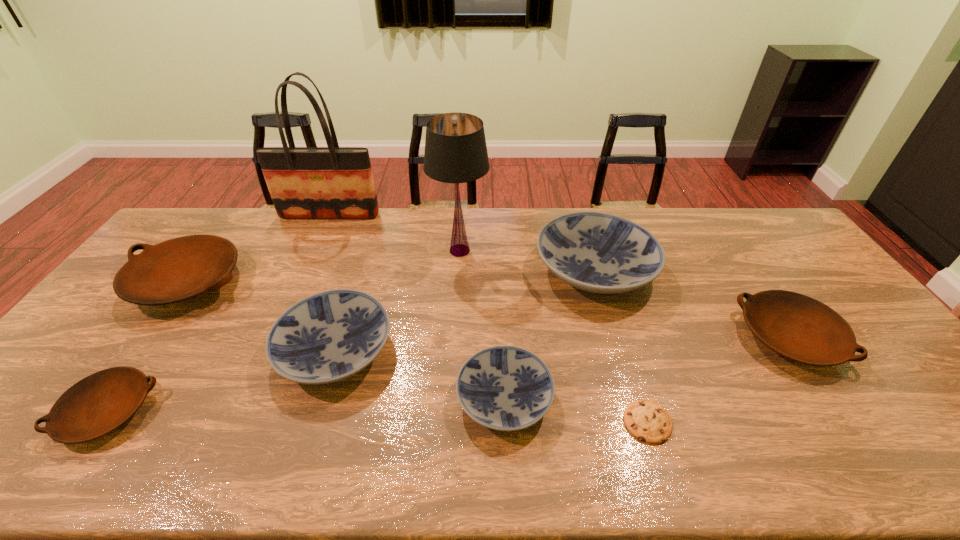
Locate an element on the screen. This screenshot has width=960, height=540. vacant space that satisfies the following two spatial constraints: 1. on the front-facing side of the lampshade; 2. on the back side of the shortest object is located at coordinates (450, 422).

I want to click on free point that satisfies the following two spatial constraints: 1. on the front side of the eighth tallest object; 2. on the left side of the biggest brown plate, so click(x=94, y=411).

Image resolution: width=960 pixels, height=540 pixels. Find the location of `vacant space that satisfies the following two spatial constraints: 1. on the front-facing side of the second smallest brown plate; 2. on the right side of the farthest object`. vacant space that satisfies the following two spatial constraints: 1. on the front-facing side of the second smallest brown plate; 2. on the right side of the farthest object is located at coordinates (275, 338).

Where is `free space that satisfies the following two spatial constraints: 1. on the front-facing side of the farthest object; 2. on the right side of the second biggest brown plate`? The width and height of the screenshot is (960, 540). free space that satisfies the following two spatial constraints: 1. on the front-facing side of the farthest object; 2. on the right side of the second biggest brown plate is located at coordinates (275, 338).

Identify the location of vacant space that satisfies the following two spatial constraints: 1. on the front-facing side of the lampshade; 2. on the left side of the cookie. (450, 422).